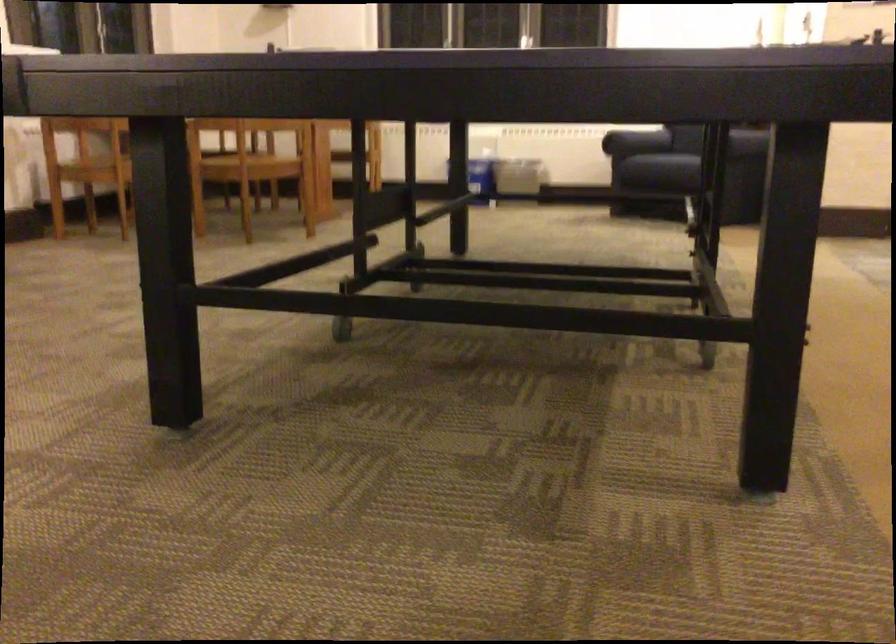
Locate an element on the screen. sofa sitting surface is located at coordinates (691, 161).